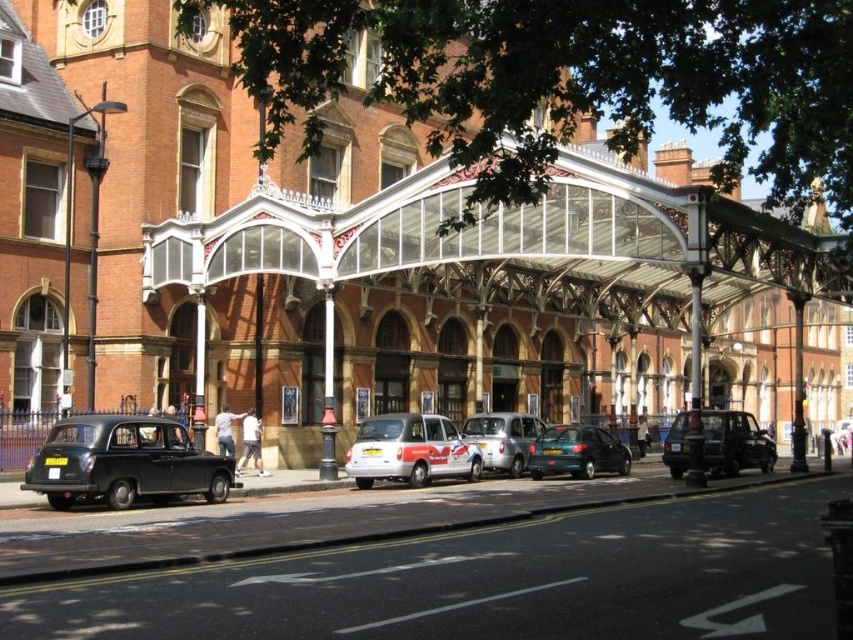
Is point (409, 474) closer to viewer compared to point (518, 461)?

Yes, it is in front of point (518, 461).

Can you confirm if white glossy taxi at center is positioned to the left of silver metallic car at center?

Correct, you'll find white glossy taxi at center to the left of silver metallic car at center.

Who is more forward, (x=358, y=429) or (x=502, y=442)?

Point (x=502, y=442) is more forward.

Identify the location of white glossy taxi at center. (410, 451).

The image size is (853, 640). I want to click on teal glossy hatchback at center, so click(x=577, y=452).

Can you confirm if brick railway station at center is bigger than white glossy taxi at center?

Indeed, brick railway station at center has a larger size compared to white glossy taxi at center.

Is brick railway station at center below white glossy taxi at center?

No.

In order to click on brick railway station at center in this screenshot , I will do click(509, 259).